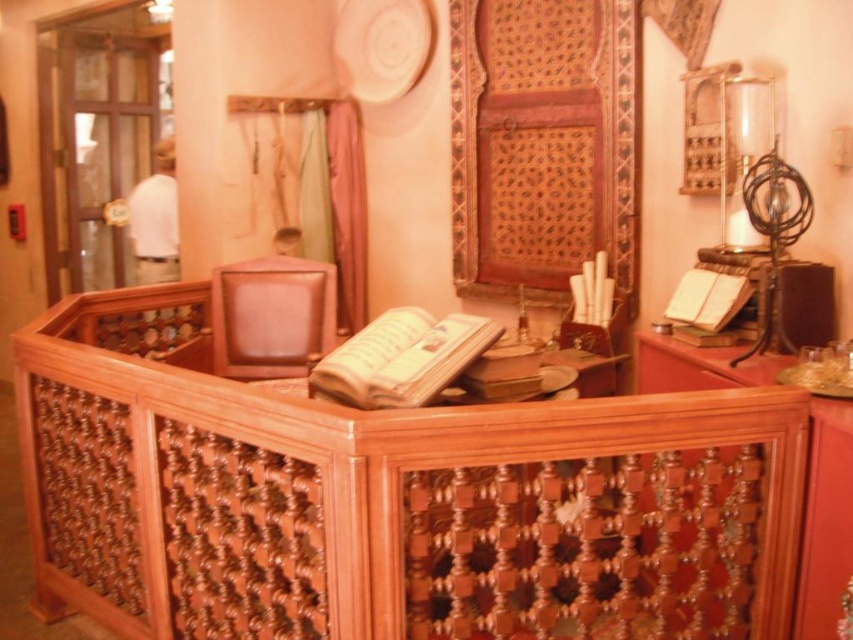
You are organizing a study area in this space and need to place both the wooden cabinet at center and the matte brown book at center. Given their sizes, which object should you place first to ensure there is enough space for both?

The wooden cabinet at center is larger than the matte brown book at center, so you should place the wooden cabinet at center first to ensure there is enough space for both objects.

Consider the image. You are an interior designer planning to place a decorative item between the clear glass globe at upper right and the white paper book at right. Which object should you place closer to the globe to maintain balance?

The clear glass globe at upper right might be wider than the white paper book at right, so placing a smaller decorative item closer to the globe would help balance the composition.

You are standing in the room and want to place a new decorative item on the wooden cabinet at center. Based on the coordinates provided, where exactly should you place it?

The wooden cabinet at center is located at coordinates point (825, 520), so you should place the decorative item there.